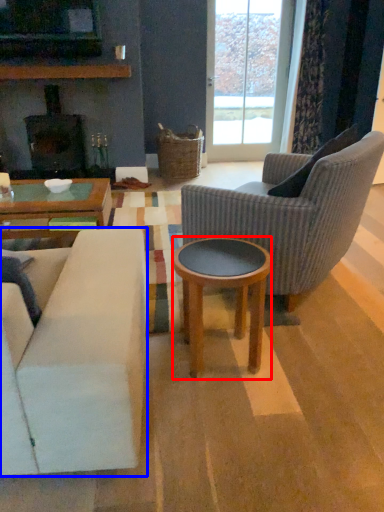
Question: Which of the following is the closest to the observer, coffee table (highlighted by a red box) or studio couch (highlighted by a blue box)?

Choices:
 (A) coffee table
 (B) studio couch

Answer: (B)